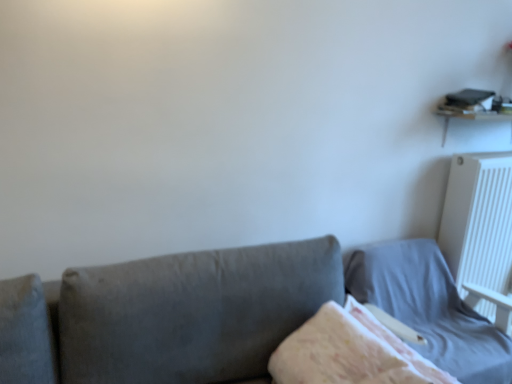
Question: Is point (486, 236) closer or farther from the camera than point (381, 370)?

Choices:
 (A) closer
 (B) farther

Answer: (B)

Question: From a real-world perspective, relative to fluffy white blanket at center, is white plastic radiator at upper right vertically above or below?

Choices:
 (A) below
 (B) above

Answer: (B)

Question: Estimate the real-world distances between objects in this image. Which object is closer to the light gray fabric bed at lower right?

Choices:
 (A) fluffy white blanket at center
 (B) white plastic radiator at upper right

Answer: (B)

Question: Considering the real-world distances, which object is closest to the fluffy white blanket at center?

Choices:
 (A) white plastic radiator at upper right
 (B) light gray fabric bed at lower right

Answer: (B)